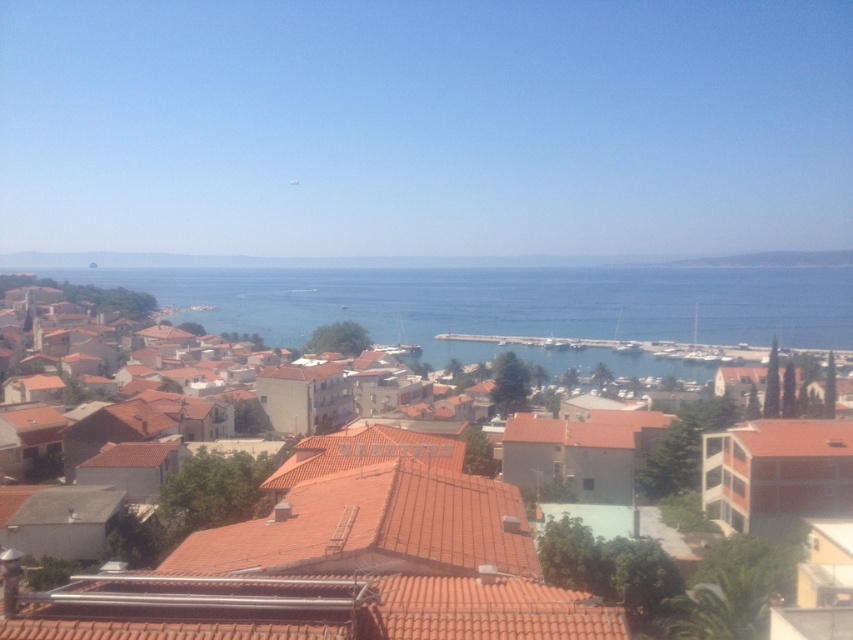
Looking at this image, does brown tile roofs at center appear on the right side of blue water at center?

Yes, brown tile roofs at center is to the right of blue water at center.

Who is taller, brown tile roofs at center or blue water at center?

blue water at center is taller.

Is point (521, 522) closer to viewer compared to point (781, 312)?

Yes, point (521, 522) is in front of point (781, 312).

You are a GUI agent. You are given a task and a screenshot of the screen. Output one action in this format:
    pyautogui.click(x=<x>, y=<y>)
    Task: Click on the brown tile roofs at center
    The width and height of the screenshot is (853, 640).
    Given the screenshot: What is the action you would take?
    pyautogui.click(x=343, y=561)